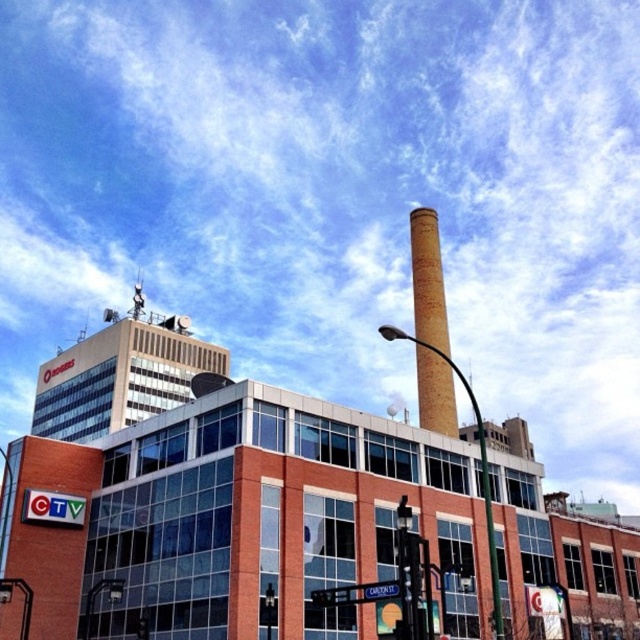
Who is shorter, brick chimney at center or brick pole at center?

Standing shorter between the two is brick chimney at center.

Which is below, brick chimney at center or brick pole at center?

brick pole at center is below.

Where is `brick chimney at center`? This screenshot has width=640, height=640. brick chimney at center is located at coordinates (428, 278).

Image resolution: width=640 pixels, height=640 pixels. I want to click on brick chimney at center, so click(x=428, y=278).